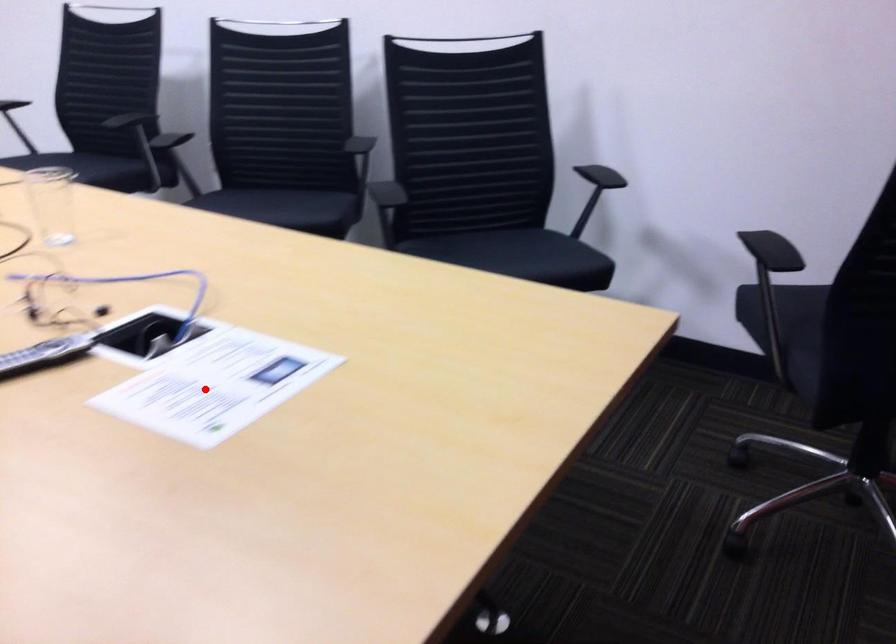
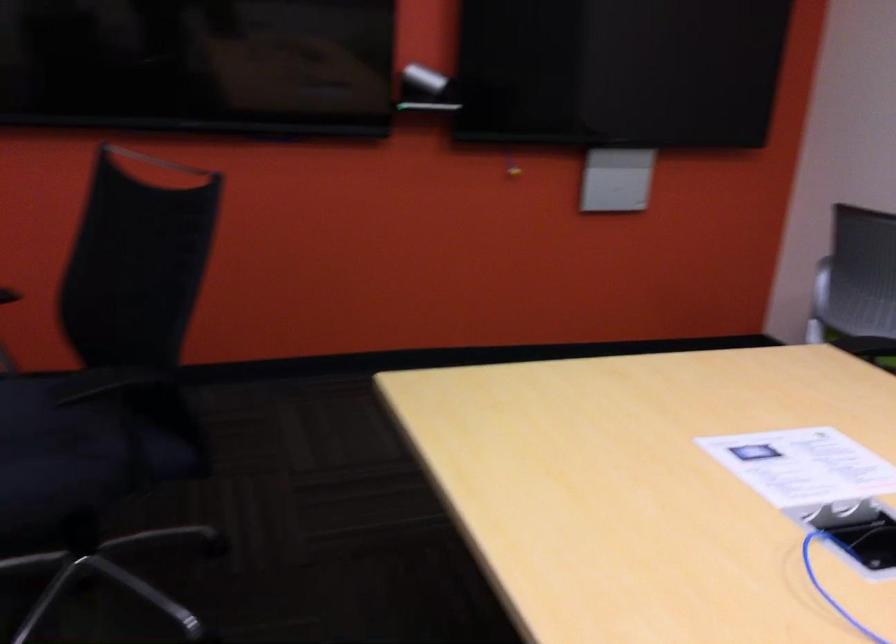
The point at the highlighted location is marked in the first image. Where is the corresponding point in the second image?

(803, 466)